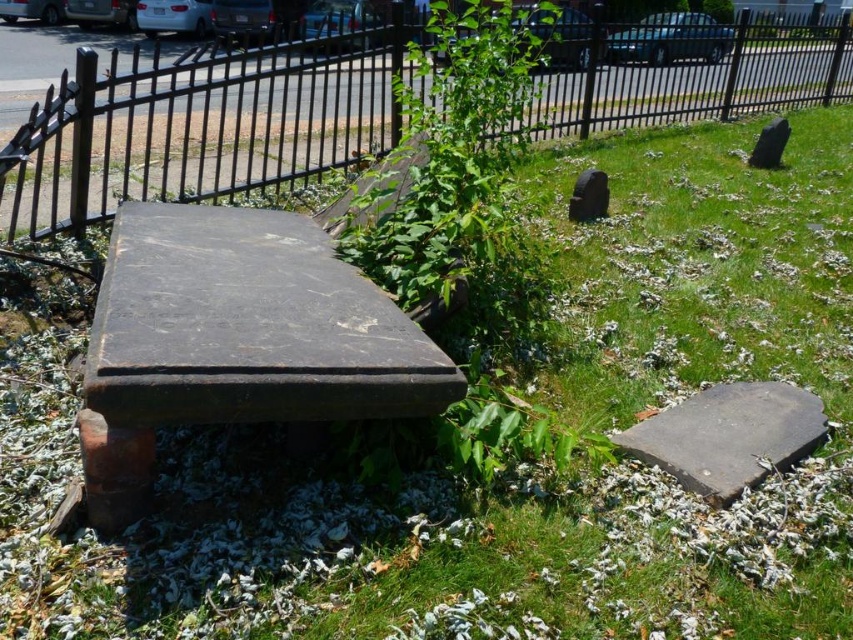
Question: Which of these objects is positioned farthest from the black stone gravestone at upper right?

Choices:
 (A) gray stone slab at lower right
 (B) green leafy plant at center
 (C) black metal fence at upper center

Answer: (C)

Question: Which object appears farthest from the camera in this image?

Choices:
 (A) gray stone slab at lower right
 (B) black stone gravestone at center-right
 (C) dark gray stone bench at center
 (D) black stone gravestone at upper right

Answer: (D)

Question: Is black metal fence at upper center in front of green leafy plant at center?

Choices:
 (A) no
 (B) yes

Answer: (A)

Question: Does green leafy plant at center appear under black stone gravestone at center-right?

Choices:
 (A) yes
 (B) no

Answer: (B)

Question: Can you confirm if dark gray stone bench at center is smaller than black stone gravestone at center-right?

Choices:
 (A) yes
 (B) no

Answer: (B)

Question: Which point appears closest to the camera in this image?

Choices:
 (A) (583, 220)
 (B) (724, 413)
 (C) (770, 156)

Answer: (B)